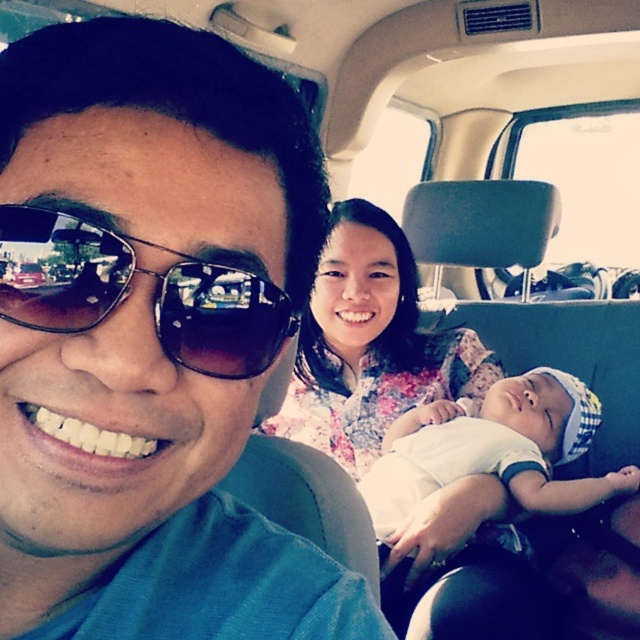
Question: Does matte black sunglasses at left have a larger size compared to floral fabric dress at center?

Choices:
 (A) yes
 (B) no

Answer: (B)

Question: Does floral fabric dress at center have a greater width compared to white soft fabric baby at center?

Choices:
 (A) yes
 (B) no

Answer: (A)

Question: Among these objects, which one is farthest from the camera?

Choices:
 (A) matte black sunglasses at left
 (B) white soft fabric baby at center

Answer: (B)

Question: Which object appears closest to the camera in this image?

Choices:
 (A) sunglasses at left
 (B) floral fabric dress at center

Answer: (A)

Question: Is matte black sunglasses at left positioned before sunglasses at left?

Choices:
 (A) no
 (B) yes

Answer: (B)

Question: Which of the following is the closest to the observer?

Choices:
 (A) white soft fabric baby at center
 (B) matte black sunglasses at left
 (C) floral fabric dress at center

Answer: (B)